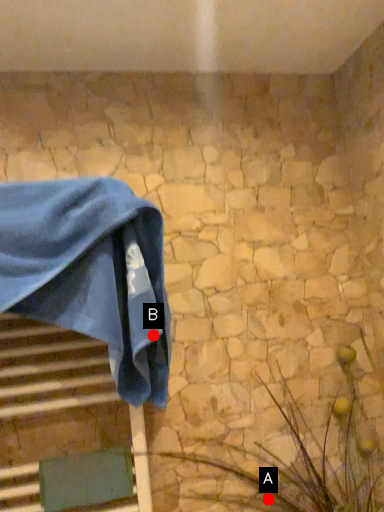
Question: Two points are circled on the image, labeled by A and B beside each circle. Among these points, which one is farthest from the camera?

Choices:
 (A) A is further
 (B) B is further

Answer: (A)